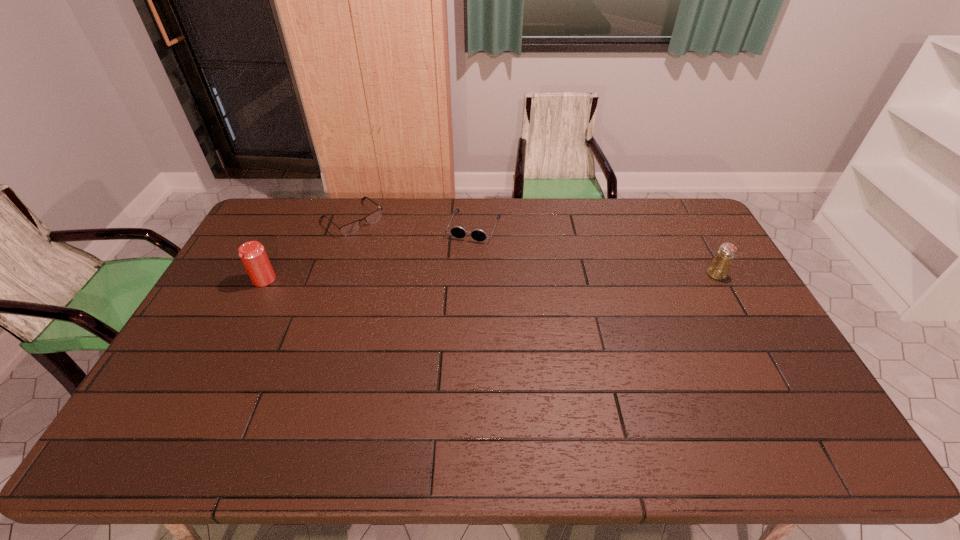
In the image, there is a desktop. Identify the location of free space at the left edge. (240, 341).

I want to click on blank space at the right edge, so click(702, 293).

Locate an element on the screen. This screenshot has height=540, width=960. free space at the near left corner of the desktop is located at coordinates (x=204, y=413).

This screenshot has width=960, height=540. In order to click on blank space at the far right corner of the desktop in this screenshot , I will do `click(707, 230)`.

Where is `free area in between the leftmost object and the saltshaker`? The height and width of the screenshot is (540, 960). free area in between the leftmost object and the saltshaker is located at coordinates (491, 277).

The height and width of the screenshot is (540, 960). Find the location of `free area in between the third object from left to right and the rightmost object`. free area in between the third object from left to right and the rightmost object is located at coordinates (595, 251).

Locate an element on the screen. The width and height of the screenshot is (960, 540). free space between the second object from left to right and the second object from right to left is located at coordinates (414, 222).

Image resolution: width=960 pixels, height=540 pixels. I want to click on free space between the second shortest object and the third object from right to left, so click(x=414, y=222).

The width and height of the screenshot is (960, 540). I want to click on vacant area that lies between the leftmost object and the saltshaker, so pyautogui.click(x=491, y=277).

I want to click on vacant space that is in between the beer can and the shortest object, so click(308, 249).